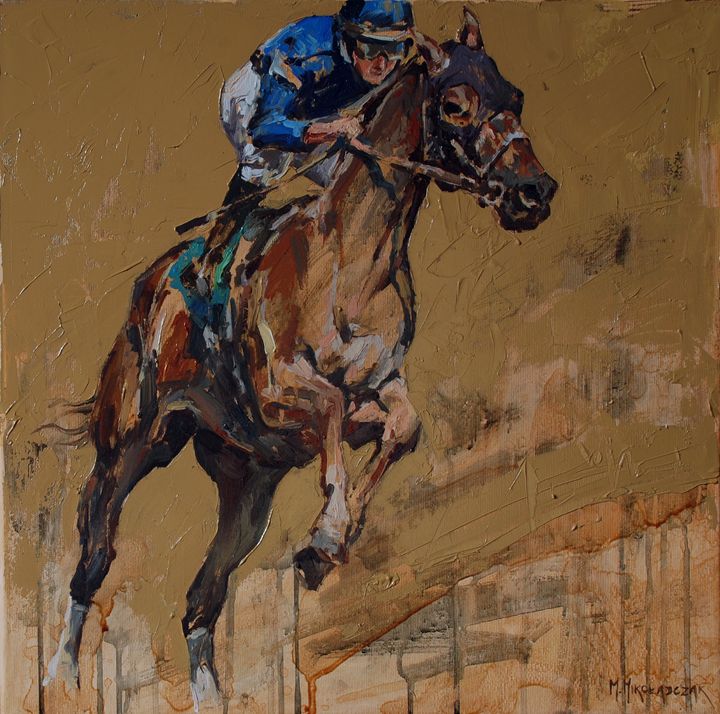
Identify the location of paint. (544, 432).